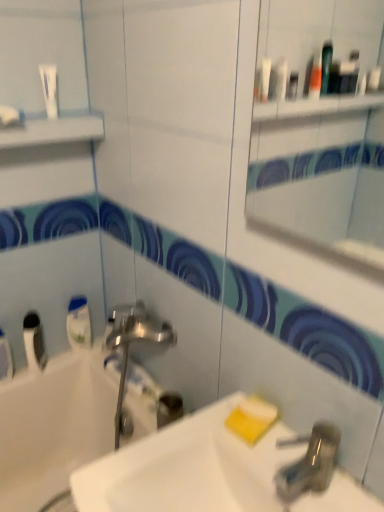
Question: Does white glossy mouthwash at left, the 1th mouthwash in the right-to-left sequence, appear on the left side of yellow matte soap at lower right, placed as the first soap when sorted from top to bottom?

Choices:
 (A) yes
 (B) no

Answer: (A)

Question: Can you confirm if white glossy mouthwash at left, the 1th mouthwash in the right-to-left sequence, is positioned to the right of yellow matte soap at lower right, placed as the first soap when sorted from top to bottom?

Choices:
 (A) no
 (B) yes

Answer: (A)

Question: From the image's perspective, is white glossy mouthwash at left, the second mouthwash when ordered from left to right, located beneath yellow matte soap at lower right, placed as the first soap when sorted from top to bottom?

Choices:
 (A) yes
 (B) no

Answer: (B)

Question: Is white glossy mouthwash at left, the 1th mouthwash in the right-to-left sequence, far away from yellow matte soap at lower right, which is counted as the 2th soap, starting from the bottom?

Choices:
 (A) yes
 (B) no

Answer: (B)

Question: Is white glossy mouthwash at left, the second mouthwash when ordered from left to right, outside yellow matte soap at lower right, placed as the first soap when sorted from top to bottom?

Choices:
 (A) yes
 (B) no

Answer: (A)

Question: Is white opaque tube at lower left, which appears as the second mouthwash when viewed from the right, situated inside white glossy tube at upper left or outside?

Choices:
 (A) outside
 (B) inside

Answer: (A)

Question: In terms of width, does white opaque tube at lower left, which appears as the second mouthwash when viewed from the right, look wider or thinner when compared to white glossy tube at upper left?

Choices:
 (A) thin
 (B) wide

Answer: (B)

Question: Relative to white glossy tube at upper left, is white opaque tube at lower left, arranged as the 1th mouthwash when viewed from the left, in front or behind?

Choices:
 (A) behind
 (B) front

Answer: (A)

Question: Is point (34, 333) positioned closer to the camera than point (54, 67)?

Choices:
 (A) farther
 (B) closer

Answer: (A)

Question: Looking at their shapes, would you say white glossy tube at upper left is wider or thinner than white glossy sink at center?

Choices:
 (A) thin
 (B) wide

Answer: (A)

Question: Is point (49, 104) closer or farther from the camera than point (258, 495)?

Choices:
 (A) farther
 (B) closer

Answer: (A)

Question: Considering the positions of white glossy tube at upper left and white glossy sink at center in the image, is white glossy tube at upper left taller or shorter than white glossy sink at center?

Choices:
 (A) tall
 (B) short

Answer: (B)

Question: Is white glossy tube at upper left bigger or smaller than white glossy sink at center?

Choices:
 (A) small
 (B) big

Answer: (A)

Question: Does point (107, 458) appear closer or farther from the camera than point (96, 413)?

Choices:
 (A) closer
 (B) farther

Answer: (A)

Question: Is white glossy sink at center in front of or behind white glossy bathtub at lower left in the image?

Choices:
 (A) behind
 (B) front

Answer: (B)